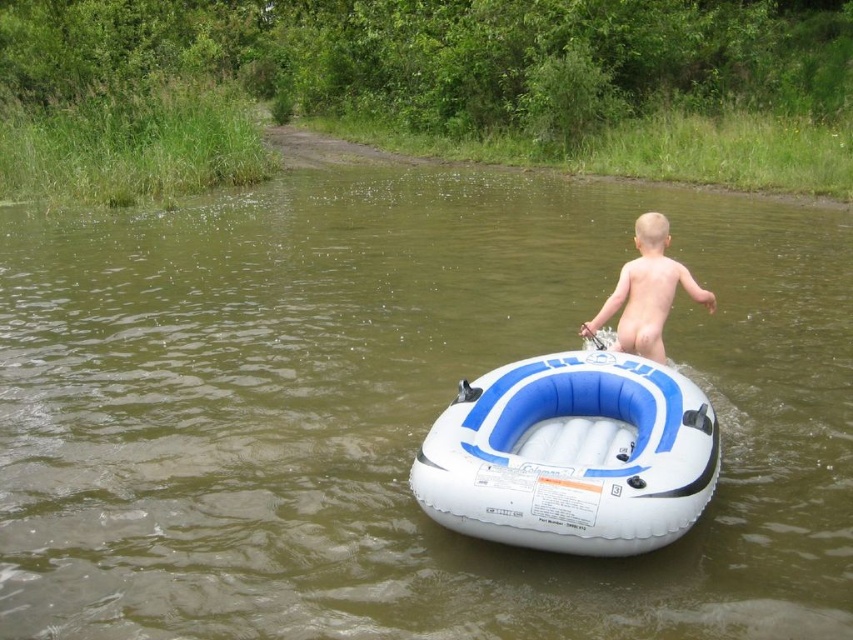
You are a lifeguard on duty and notice the naked skin boy at center holding onto the white inflatable boat at center. Based on their heights, which one is taller?

The white inflatable boat at center is taller than the naked skin boy at center.

Consider the image. You are a lifeguard at a lake and see a child in the water. The child is holding onto an object. Based on the scene, can you determine if the white inflatable boat at center is large enough to support the naked skin boy at center?

The white inflatable boat at center is bigger than the naked skin boy at center, so it is likely large enough to support him.

You are a lifeguard on duty at a lake. You notice the naked skin boy at center holding onto the white inflatable boat at center. Based on their positions, can you determine if the boy is standing in the water or on the shore?

→ The white inflatable boat at center is positioned under the naked skin boy at center, which means the boy is standing in the water since the boat is submerged beneath him.